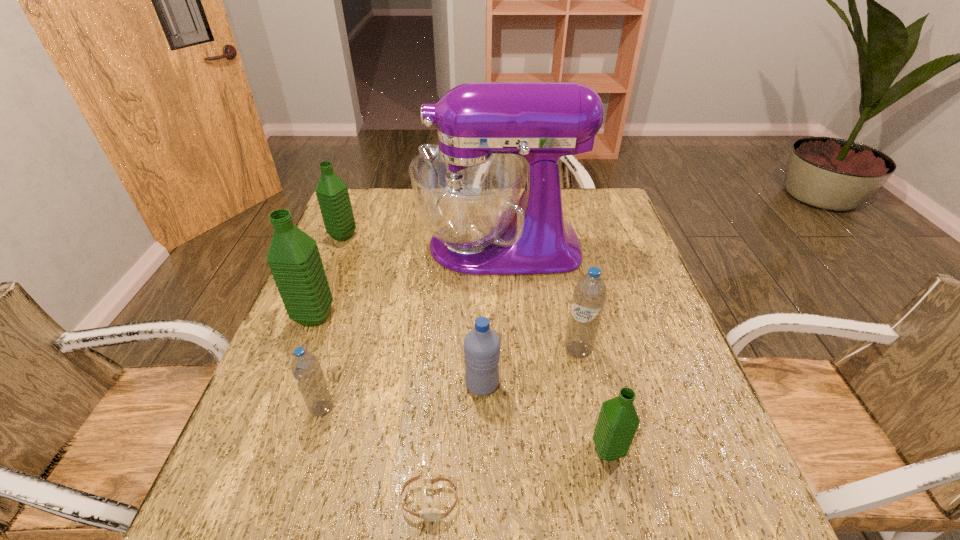
Find the location of a particular element. Image resolution: width=960 pixels, height=540 pixels. object identified as the seventh closest to the second blue water bottle from left to right is located at coordinates (332, 193).

Locate an element on the screen. The image size is (960, 540). the fifth closest object to the fourth water bottle from left to right is located at coordinates (467, 189).

Identify which water bottle is the second nearest to the sixth object from right to left. Please provide its 2D coordinates. Your answer should be formatted as a tuple, i.e. [(x, y)], where the tuple contains the x and y coordinates of a point satisfying the conditions above.

[(482, 345)]

This screenshot has height=540, width=960. What are the coordinates of `water bottle that is the closest to the biggest green water bottle` in the screenshot? It's located at (306, 369).

The image size is (960, 540). Identify the location of green water bottle that stands as the second closest to the second blue water bottle from right to left. (293, 257).

Identify the location of green water bottle that can be found as the second closest to the farthest green water bottle. This screenshot has height=540, width=960. (618, 421).

Select which blue water bottle appears as the second closest to the farthest water bottle. Please provide its 2D coordinates. Your answer should be formatted as a tuple, i.e. [(x, y)], where the tuple contains the x and y coordinates of a point satisfying the conditions above.

[(482, 345)]

Choose which blue water bottle is the second nearest neighbor to the smallest green water bottle. Please provide its 2D coordinates. Your answer should be formatted as a tuple, i.e. [(x, y)], where the tuple contains the x and y coordinates of a point satisfying the conditions above.

[(482, 345)]

Find the location of a particular element. free spot that satisfies the following two spatial constraints: 1. on the front side of the fourth nearest water bottle; 2. on the left side of the farthest water bottle is located at coordinates (298, 350).

This screenshot has width=960, height=540. I want to click on vacant area that satisfies the following two spatial constraints: 1. on the front side of the seventh farthest object; 2. on the right side of the farthest water bottle, so click(x=257, y=450).